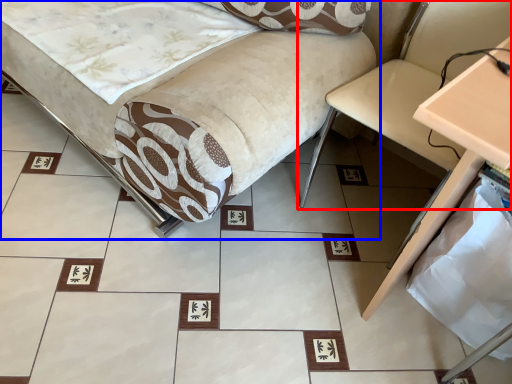
Question: Which object is further to the camera taking this photo, swivel chair (highlighted by a red box) or furniture (highlighted by a blue box)?

Choices:
 (A) swivel chair
 (B) furniture

Answer: (A)